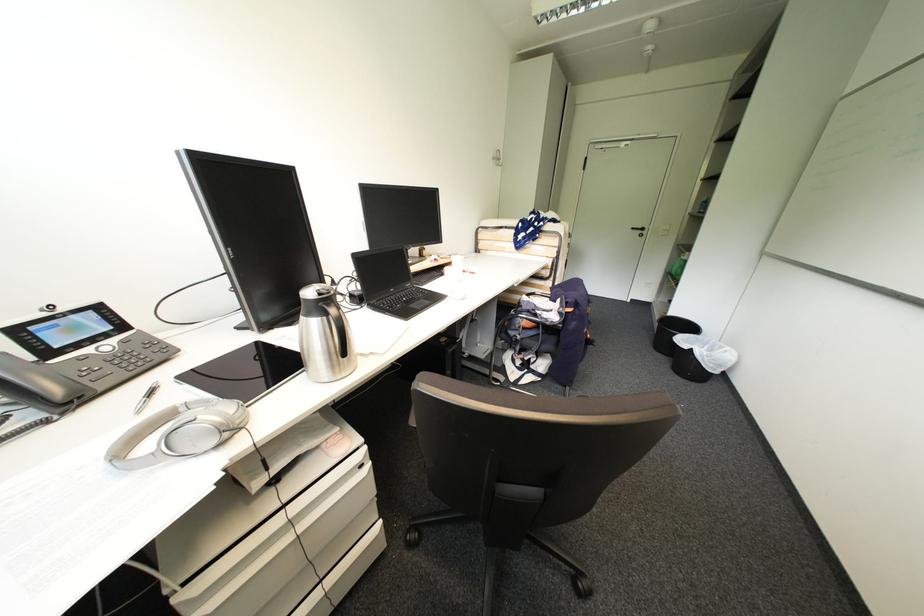
This screenshot has height=616, width=924. Identify the location of white door handle. (640, 230).